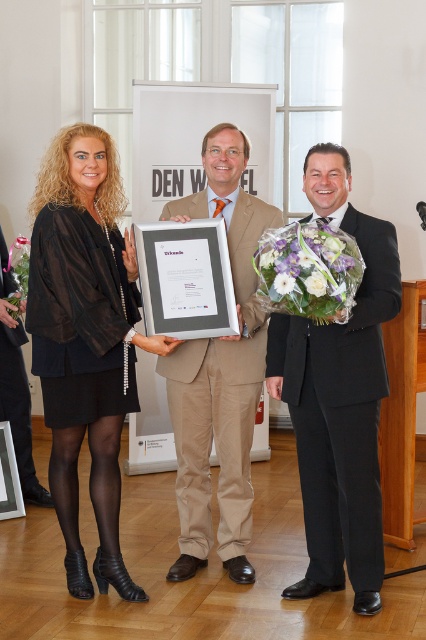
Does black satin dress at center have a larger size compared to white floral bouquet at center?

Yes, black satin dress at center is bigger than white floral bouquet at center.

Does black satin dress at center have a greater width compared to white floral bouquet at center?

Yes.

The image size is (426, 640). What do you see at coordinates (86, 339) in the screenshot?
I see `black satin dress at center` at bounding box center [86, 339].

Image resolution: width=426 pixels, height=640 pixels. I want to click on black satin dress at center, so click(x=86, y=339).

Between point (374, 472) and point (241, 324), which one is positioned in front?

Point (374, 472) is in front.

Is point (339, 186) closer to camera compared to point (244, 404)?

That is True.

Does point (374, 416) come behind point (250, 300)?

No.

Locate an element on the screen. black suit at center is located at coordinates (339, 397).

Does point (310, 280) come farther from viewer compared to point (279, 292)?

That is False.

Between white matte flower at center and white silk flower at center, which one appears on the right side from the viewer's perspective?

white matte flower at center

Locate an element on the screen. The image size is (426, 640). white matte flower at center is located at coordinates (316, 284).

The width and height of the screenshot is (426, 640). Identify the location of white matte flower at center. (316, 284).